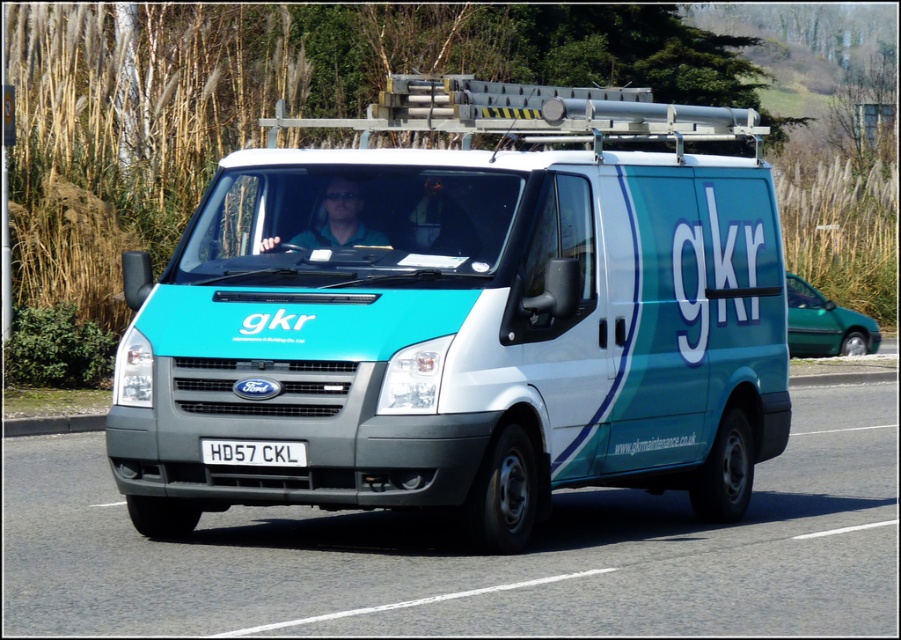
Who is more forward, (x=335, y=236) or (x=210, y=456)?

Point (x=210, y=456)

You are a GUI agent. You are given a task and a screenshot of the screen. Output one action in this format:
    pyautogui.click(x=<x>, y=<y>)
    Task: Click on the matte green shirt at center
    The height and width of the screenshot is (640, 901).
    Given the screenshot: What is the action you would take?
    pyautogui.click(x=340, y=220)

Which of these two, teal matte van at center or matte green shirt at center, stands taller?

Standing taller between the two is teal matte van at center.

Can you confirm if teal matte van at center is positioned to the right of matte green shirt at center?

No, teal matte van at center is not to the right of matte green shirt at center.

Is point (667, 186) positioned before point (360, 232)?

No, it is not.

At what (x,y) coordinates should I click in order to perform the action: click on teal matte van at center. Please return your answer as a coordinate pair (x, y). Looking at the image, I should click on (466, 320).

Does teal matte van at center have a smaller size compared to white plastic license plate at center?

No, teal matte van at center is not smaller than white plastic license plate at center.

Does teal matte van at center have a greater width compared to white plastic license plate at center?

Yes.

Who is more forward, [749,444] or [292,451]?

Result: Point [292,451] is more forward.

Locate an element on the screen. This screenshot has width=901, height=640. teal matte van at center is located at coordinates (466, 320).